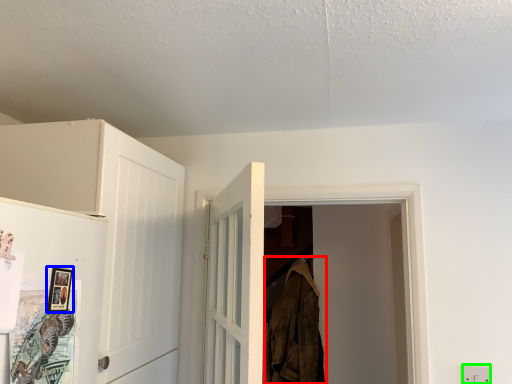
Question: Estimate the real-world distances between objects in this image. Which object is farther from clothing (highlighted by a red box), picture frame (highlighted by a blue box) or electric outlet (highlighted by a green box)?

Choices:
 (A) picture frame
 (B) electric outlet

Answer: (A)